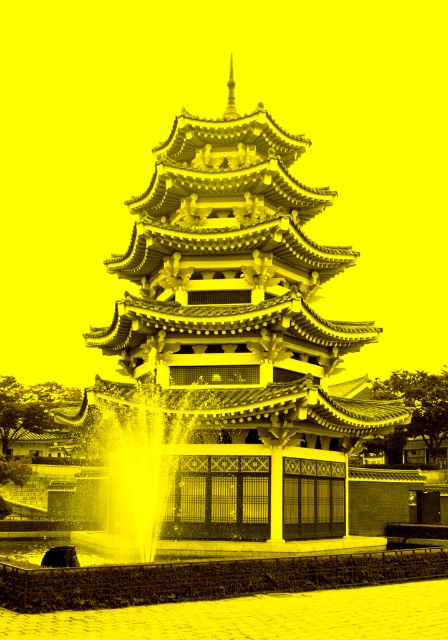
Is yellowish-white stone pagoda at center bigger than translucent glass fountain at center?

Correct, yellowish-white stone pagoda at center is larger in size than translucent glass fountain at center.

Does yellowish-white stone pagoda at center have a lesser height compared to translucent glass fountain at center?

Incorrect, yellowish-white stone pagoda at center's height does not fall short of translucent glass fountain at center's.

At what (x,y) coordinates should I click in order to perform the action: click on yellowish-white stone pagoda at center. Please return your answer as a coordinate pair (x, y). The width and height of the screenshot is (448, 640). Looking at the image, I should click on (231, 346).